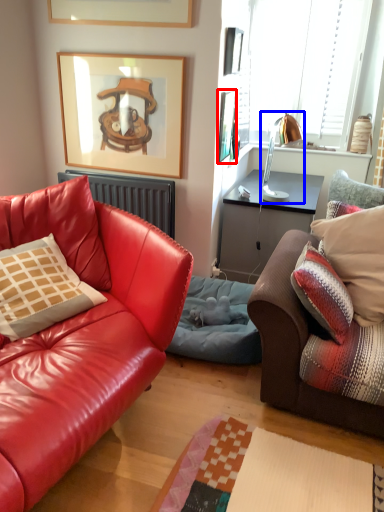
Question: Which object is closer to the camera taking this photo, picture frame (highlighted by a red box) or lamp (highlighted by a blue box)?

Choices:
 (A) picture frame
 (B) lamp

Answer: (A)